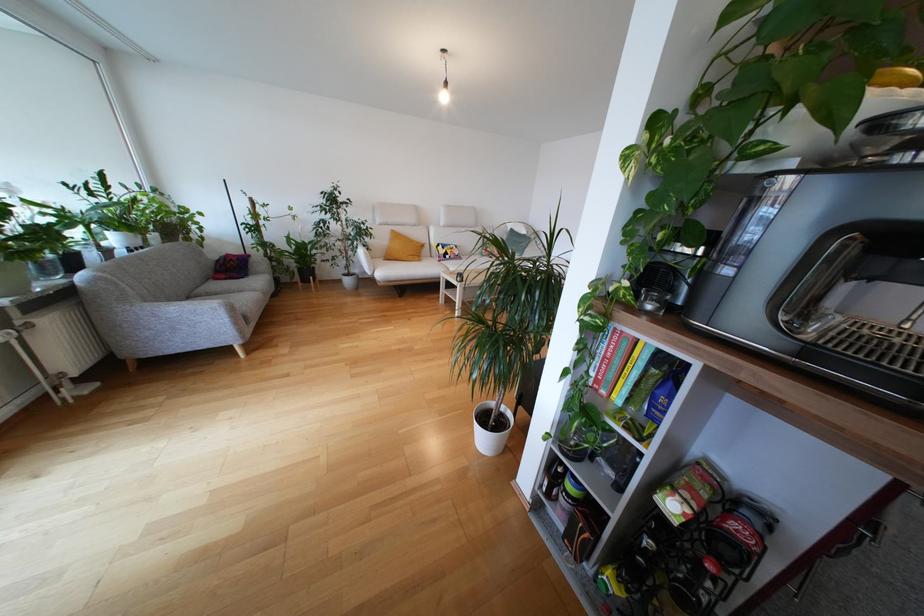
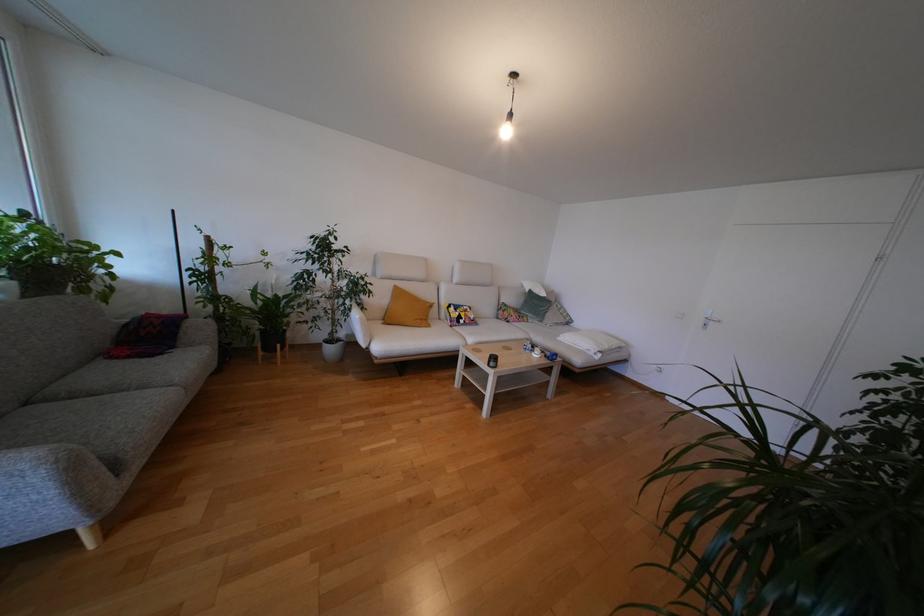
Which direction would the cameraman need to move to produce the second image?

The movement direction of the cameraman is left, forward.